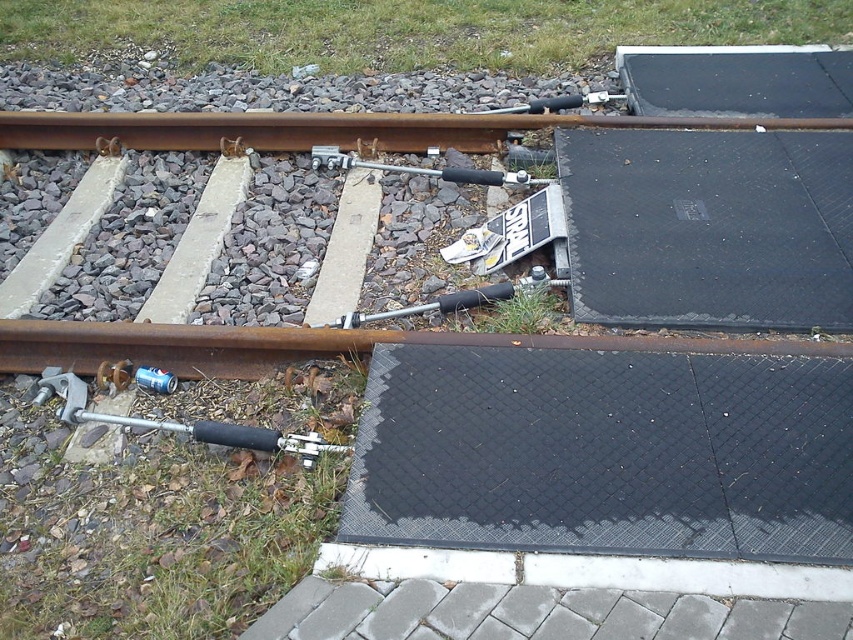
Is black rubber mat at lower right shorter than metallic silver tool at lower left?

Incorrect, black rubber mat at lower right's height does not fall short of metallic silver tool at lower left's.

Can you confirm if black rubber mat at lower right is wider than metallic silver tool at lower left?

Correct, the width of black rubber mat at lower right exceeds that of metallic silver tool at lower left.

Does point (721, 378) lie in front of point (318, 440)?

That is False.

I want to click on black rubber mat at lower right, so click(604, 452).

Is rusty metal train track at upper center wider than metallic silver tool at lower left?

Yes.

Is point (19, 132) less distant than point (42, 397)?

No.

Between point (55, 129) and point (305, 445), which one is positioned in front?

Point (305, 445)

Locate an element on the screen. rusty metal train track at upper center is located at coordinates (328, 129).

Can you confirm if black rubber mat at lower right is shorter than rusty metal train track at lower center?

No, black rubber mat at lower right is not shorter than rusty metal train track at lower center.

Between point (688, 481) and point (398, 336), which one is positioned behind?

The point (398, 336) is behind.

Image resolution: width=853 pixels, height=640 pixels. I want to click on black rubber mat at lower right, so click(x=604, y=452).